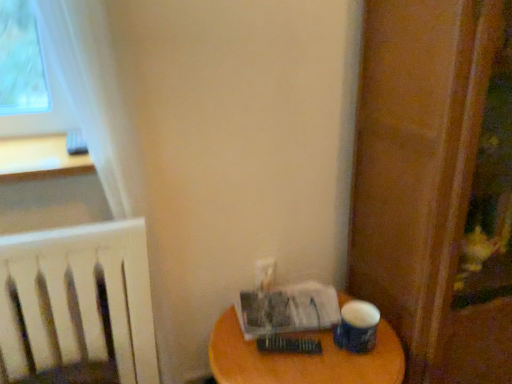
The height and width of the screenshot is (384, 512). Identify the location of free point below white paper at lower right, arranged as the 2th paperback book when viewed from the front (from a real-world perspective). (288, 316).